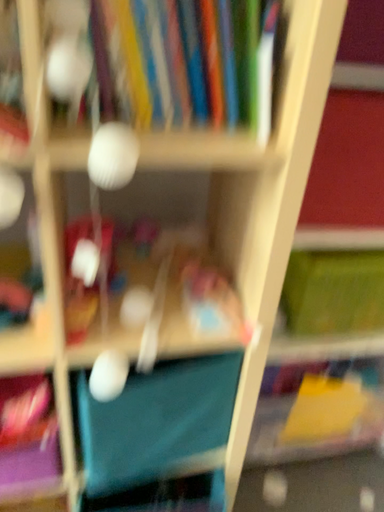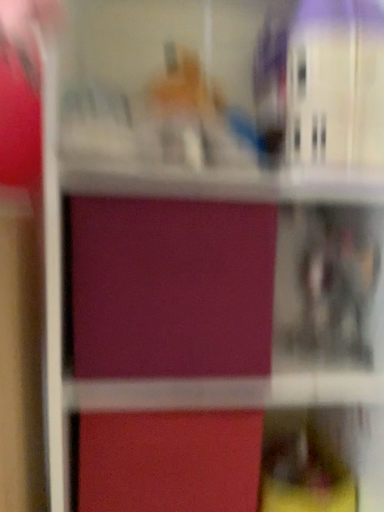
Question: Which way did the camera rotate in the video?

Choices:
 (A) rotated upward
 (B) rotated downward

Answer: (A)